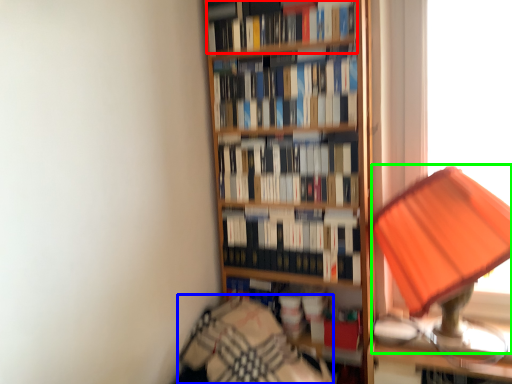
Question: Which object is the farthest from book (highlighted by a red box)? Choose among these: bedding (highlighted by a blue box) or table lamp (highlighted by a green box).

Choices:
 (A) bedding
 (B) table lamp

Answer: (A)